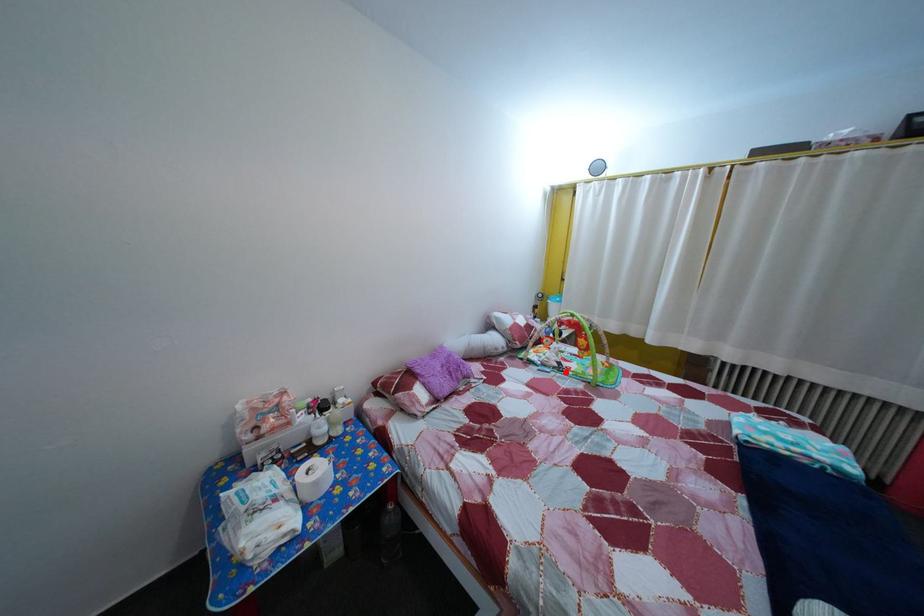
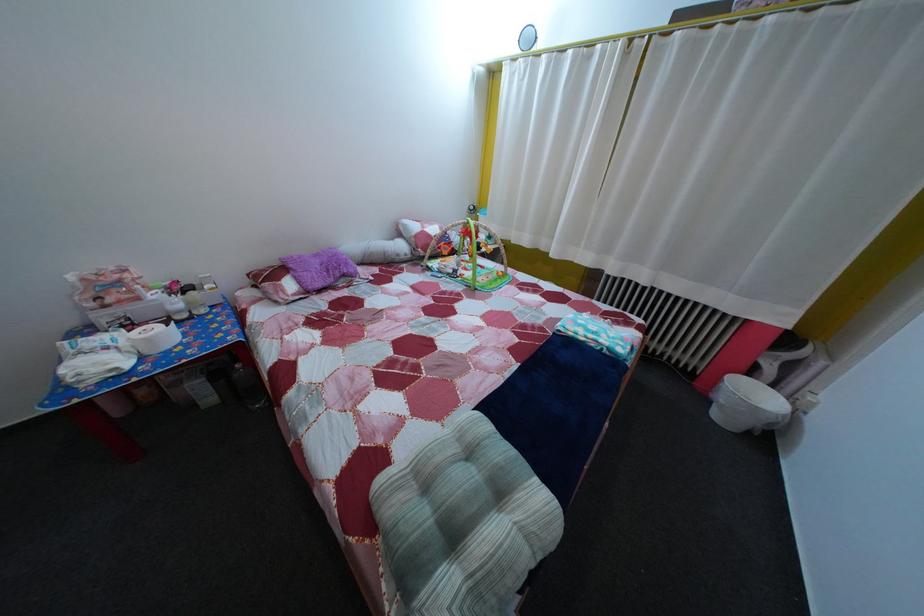
Locate, in the second image, the point that corresponds to the highlighted location in the first image.

(459, 278)